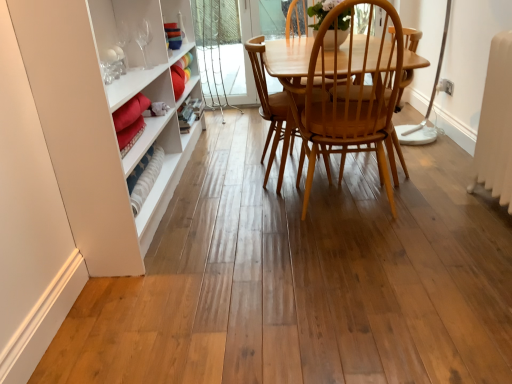
Describe the element at coordinates (289, 56) in the screenshot. The height and width of the screenshot is (384, 512). I see `light brown wood chair at center` at that location.

You are a GUI agent. You are given a task and a screenshot of the screen. Output one action in this format:
    pyautogui.click(x=<x>, y=<y>)
    Task: Click on the light brown wood chair at center
    
    Given the screenshot: What is the action you would take?
    pyautogui.click(x=289, y=56)

What do you see at coordinates (273, 105) in the screenshot? The height and width of the screenshot is (384, 512). I see `light brown wood chair at center` at bounding box center [273, 105].

I want to click on light brown wood chair at center, so click(273, 105).

In order to face light brown wood chair at center, should I rotate leftwards or rightwards?

To align with it, rotate right about 4.451°.

Find the location of a particular element. This screenshot has height=384, width=512. light brown wood chair at center is located at coordinates (289, 56).

Is light brown wood chair at center to the left of light brown wood chair at center from the viewer's perspective?

Correct, you'll find light brown wood chair at center to the left of light brown wood chair at center.

Which is behind, light brown wood chair at center or light brown wood chair at center?

light brown wood chair at center is more distant.

Which is behind, point (269, 138) or point (281, 46)?

The point (269, 138) is farther from the camera.

From the image's perspective, is light brown wood chair at center on light brown wood chair at center?

Yes, from the image's perspective, light brown wood chair at center is above light brown wood chair at center.

From a real-world perspective, is light brown wood chair at center above or below light brown wood chair at center?

Clearly, from a real-world perspective, light brown wood chair at center is below light brown wood chair at center.

Does light brown wood chair at center have a greater width compared to light brown wood chair at center?

No.

Who is taller, light brown wood chair at center or light brown wood chair at center?

With more height is light brown wood chair at center.

Based on their sizes in the image, would you say light brown wood chair at center is bigger or smaller than light brown wood chair at center?

In the image, light brown wood chair at center appears to be smaller than light brown wood chair at center.

Is light brown wood chair at center completely or partially inside light brown wood chair at center?

No, light brown wood chair at center is not surrounded by light brown wood chair at center.

Are light brown wood chair at center and light brown wood chair at center beside each other?

No, light brown wood chair at center is not making contact with light brown wood chair at center.

Is light brown wood chair at center positioned with its back to light brown wood chair at center?

light brown wood chair at center is not turned away from light brown wood chair at center.

Identify the location of chair in front of the light brown wood chair at center. The height and width of the screenshot is (384, 512). (289, 56).

In the image, is light brown wood chair at center on the left side or the right side of light brown wood chair at center?

Clearly, light brown wood chair at center is on the right of light brown wood chair at center in the image.

Who is more distant, light brown wood chair at center or light brown wood chair at center?

light brown wood chair at center is behind.

Does point (303, 72) appear closer or farther from the camera than point (263, 84)?

Point (303, 72) appears to be closer to the viewer than point (263, 84).

From the image's perspective, relative to light brown wood chair at center, is light brown wood chair at center above or below?

Based on their image positions, light brown wood chair at center is located beneath light brown wood chair at center.

From a real-world perspective, is light brown wood chair at center on light brown wood chair at center?

Yes, from a real-world perspective, light brown wood chair at center is above light brown wood chair at center.

Does light brown wood chair at center have a greater width compared to light brown wood chair at center?

Yes, light brown wood chair at center is wider than light brown wood chair at center.

Who is taller, light brown wood chair at center or light brown wood chair at center?

light brown wood chair at center is taller.

Who is bigger, light brown wood chair at center or light brown wood chair at center?

With larger size is light brown wood chair at center.

Consider the image. Is light brown wood chair at center completely or partially inside light brown wood chair at center?

No.

Is light brown wood chair at center not close to light brown wood chair at center?

No, light brown wood chair at center is not far away from light brown wood chair at center.

Could you tell me if light brown wood chair at center is turned towards light brown wood chair at center?

Yes, light brown wood chair at center is aimed at light brown wood chair at center.

In order to click on armchair located underneath the light brown wood chair at center (from a real-world perspective) in this screenshot , I will do `click(273, 105)`.

This screenshot has width=512, height=384. I want to click on armchair that appears behind the light brown wood chair at center, so click(273, 105).

Where is `armchair on the left of light brown wood chair at center`? The height and width of the screenshot is (384, 512). armchair on the left of light brown wood chair at center is located at coordinates coord(273,105).